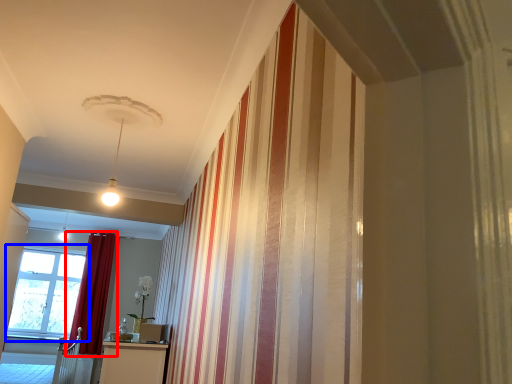
Question: Among these objects, which one is farthest to the camera, curtain (highlighted by a red box) or window (highlighted by a blue box)?

Choices:
 (A) curtain
 (B) window

Answer: (B)